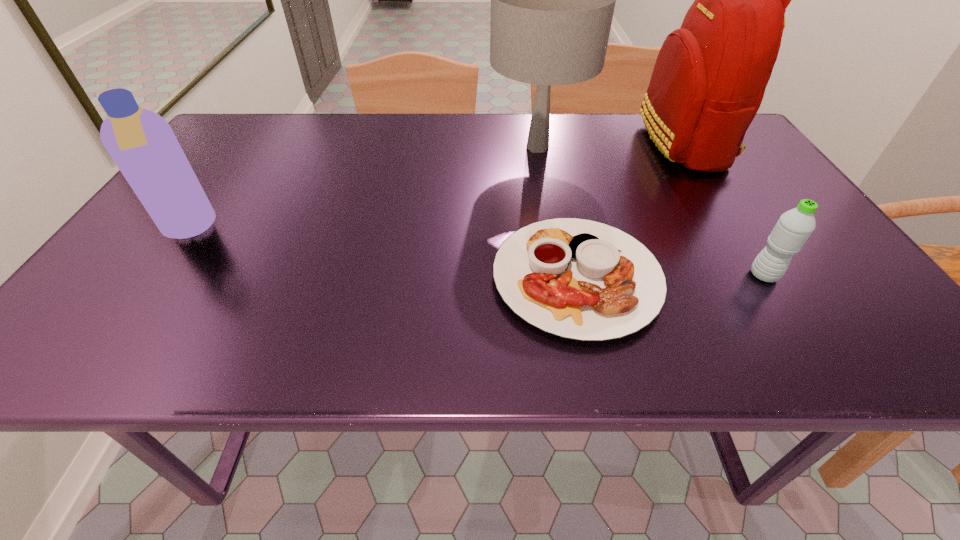
Find the location of a particular element. vacant space located 0.390m on the front-facing side of the fourth shortest object is located at coordinates (345, 147).

Find the location of a particular element. The width and height of the screenshot is (960, 540). vacant region located on the front-facing side of the fourth shortest object is located at coordinates (411, 147).

The image size is (960, 540). Identify the location of vacant space located on the back of the leftmost object. (242, 154).

The width and height of the screenshot is (960, 540). Find the location of `free space located on the front of the second shortest object`. free space located on the front of the second shortest object is located at coordinates (782, 306).

In order to click on free space located 0.060m on the back of the shortest object in this screenshot , I will do `click(562, 208)`.

The width and height of the screenshot is (960, 540). Find the location of `backpack located in the far edge section of the desktop`. backpack located in the far edge section of the desktop is located at coordinates 709,79.

Find the location of `lampshade located in the far edge section of the desktop`. lampshade located in the far edge section of the desktop is located at coordinates (552, 0).

You are a GUI agent. You are given a task and a screenshot of the screen. Output one action in this format:
    pyautogui.click(x=<x>, y=<y>)
    Task: Click on the object situated at the near edge
    This screenshot has width=960, height=540.
    Given the screenshot: What is the action you would take?
    [x=580, y=279]

Where is `object located at the left edge`? The height and width of the screenshot is (540, 960). object located at the left edge is located at coordinates (142, 144).

Where is `backpack located in the right edge section of the desktop`? Image resolution: width=960 pixels, height=540 pixels. backpack located in the right edge section of the desktop is located at coordinates (709, 79).